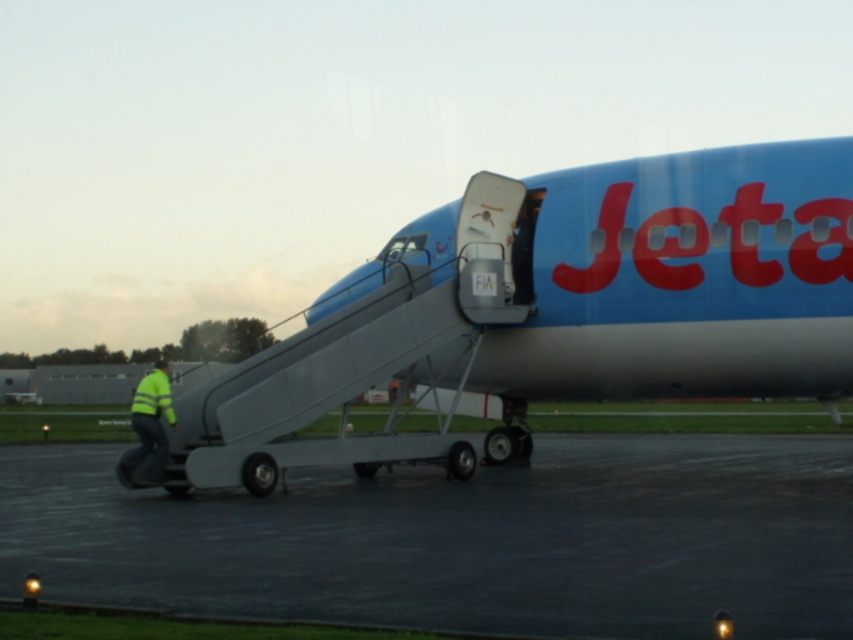
You are a pilot preparing to taxi the blue matte airplane at center from the black asphalt tarmac at lower center. Considering their sizes, will the airplane fit on the tarmac without needing to adjust its position?

The blue matte airplane at center is smaller in size compared to the black asphalt tarmac at lower center, so it should fit without needing adjustments.

In the scene shown: You are a passenger standing at the bottom of the mobile staircase. You need to reach the point marked as point (38,554). Is this point located in front of or behind the point marked as point (161,456)?

The point (38,554) is in front of point (161,456), so you should move forward towards it.